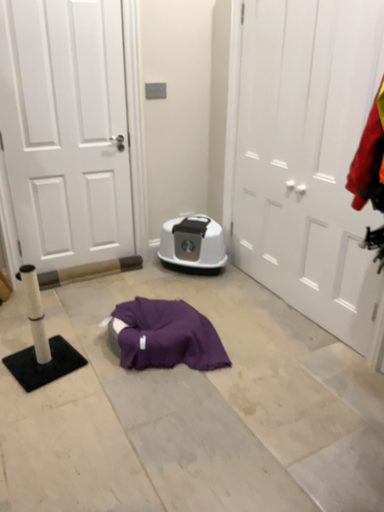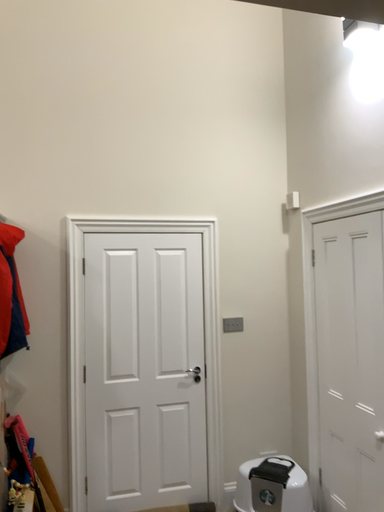
Question: How did the camera likely rotate when shooting the video?

Choices:
 (A) rotated upward
 (B) rotated downward

Answer: (A)